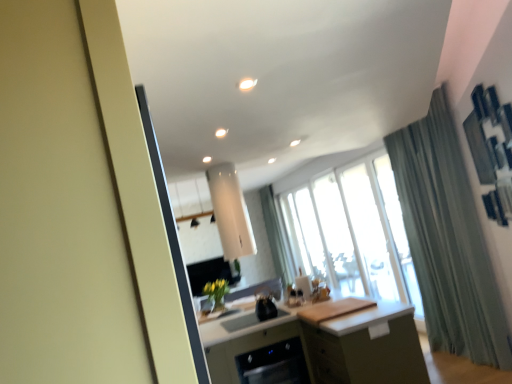
Question: Is the position of green fabric curtain at right less distant than that of matte white screen door at left?

Choices:
 (A) yes
 (B) no

Answer: (B)

Question: Is green fabric curtain at right to the right of matte white screen door at left from the viewer's perspective?

Choices:
 (A) yes
 (B) no

Answer: (A)

Question: Is green fabric curtain at right turned away from matte white screen door at left?

Choices:
 (A) yes
 (B) no

Answer: (B)

Question: Would you consider green fabric curtain at right to be distant from matte white screen door at left?

Choices:
 (A) no
 (B) yes

Answer: (B)

Question: Considering the relative sizes of green fabric curtain at right and matte white screen door at left in the image provided, is green fabric curtain at right taller than matte white screen door at left?

Choices:
 (A) yes
 (B) no

Answer: (A)

Question: Does green fabric curtain at right have a lesser width compared to matte white screen door at left?

Choices:
 (A) yes
 (B) no

Answer: (A)

Question: Is matte green cabinet at center placed right next to green fabric curtain at right?

Choices:
 (A) no
 (B) yes

Answer: (A)

Question: From a real-world perspective, is matte green cabinet at center physically below green fabric curtain at right?

Choices:
 (A) yes
 (B) no

Answer: (A)

Question: Is matte green cabinet at center to the left of green fabric curtain at right from the viewer's perspective?

Choices:
 (A) yes
 (B) no

Answer: (A)

Question: Can you confirm if matte green cabinet at center is bigger than green fabric curtain at right?

Choices:
 (A) yes
 (B) no

Answer: (A)

Question: From the image's perspective, is matte green cabinet at center beneath green fabric curtain at right?

Choices:
 (A) yes
 (B) no

Answer: (A)

Question: From the image's perspective, is matte green cabinet at center over green fabric curtain at right?

Choices:
 (A) no
 (B) yes

Answer: (A)

Question: From the image's perspective, is matte white screen door at left on top of green fabric curtain at right?

Choices:
 (A) yes
 (B) no

Answer: (A)